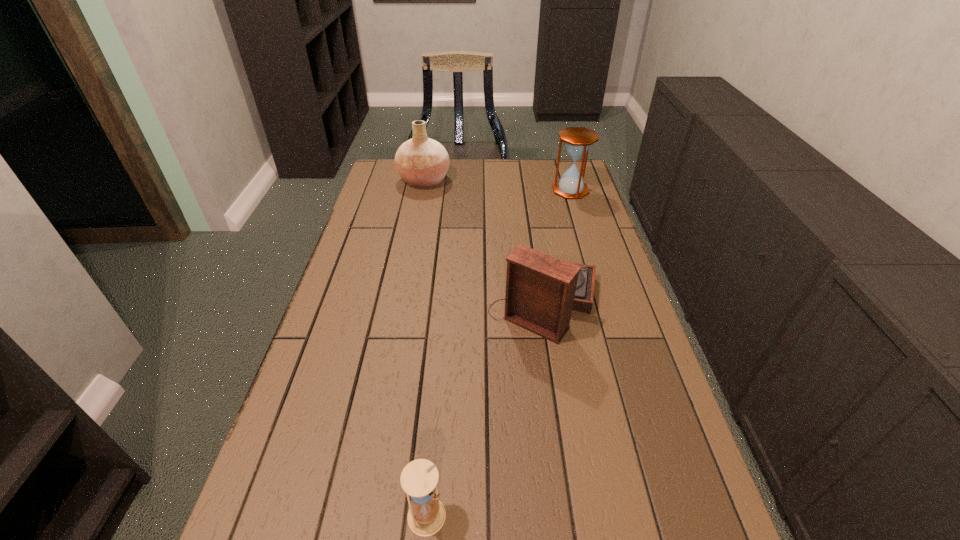
Where is `free spot between the left hourglass and the third farthest object`? This screenshot has width=960, height=540. free spot between the left hourglass and the third farthest object is located at coordinates (486, 409).

Locate an element on the screen. This screenshot has height=540, width=960. free area in between the pottery and the nearer hourglass is located at coordinates (425, 348).

This screenshot has height=540, width=960. Find the location of `free space between the farther hourglass and the pottery`. free space between the farther hourglass and the pottery is located at coordinates point(497,185).

The image size is (960, 540). In order to click on empty location between the right hourglass and the pottery in this screenshot , I will do `click(497, 185)`.

This screenshot has height=540, width=960. Identify the location of free space between the phonograph record and the pottery. (484, 241).

At what (x,y) coordinates should I click in order to perform the action: click on empty space that is in between the phonograph record and the taller hourglass. Please return your answer as a coordinate pair (x, y). This screenshot has width=960, height=540. Looking at the image, I should click on (558, 246).

You are a GUI agent. You are given a task and a screenshot of the screen. Output one action in this format:
    pyautogui.click(x=<x>, y=<y>)
    Task: Click on the free space between the pottery and the right hourglass
    This screenshot has height=540, width=960.
    Given the screenshot: What is the action you would take?
    pyautogui.click(x=497, y=185)

Locate an element on the screen. free space between the right hourglass and the second nearest object is located at coordinates (558, 246).

This screenshot has width=960, height=540. I want to click on free space between the nearer hourglass and the third farthest object, so click(486, 409).

Locate an element on the screen. object that ranks as the second closest to the pottery is located at coordinates (541, 291).